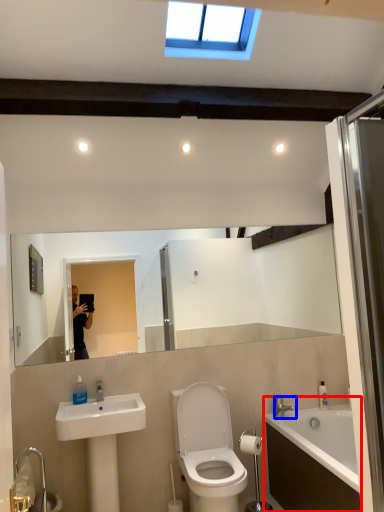
Question: Which of the following is the closest to the observer, bathtub (highlighted by a red box) or tap (highlighted by a blue box)?

Choices:
 (A) bathtub
 (B) tap

Answer: (A)